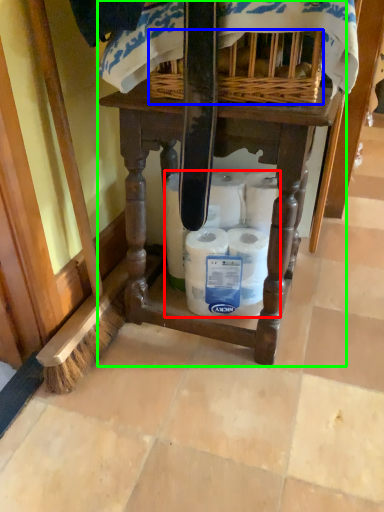
Question: Which is nearer to the toilet paper (highlighted by a red box)? basket (highlighted by a blue box) or furniture (highlighted by a green box).

Choices:
 (A) basket
 (B) furniture

Answer: (B)